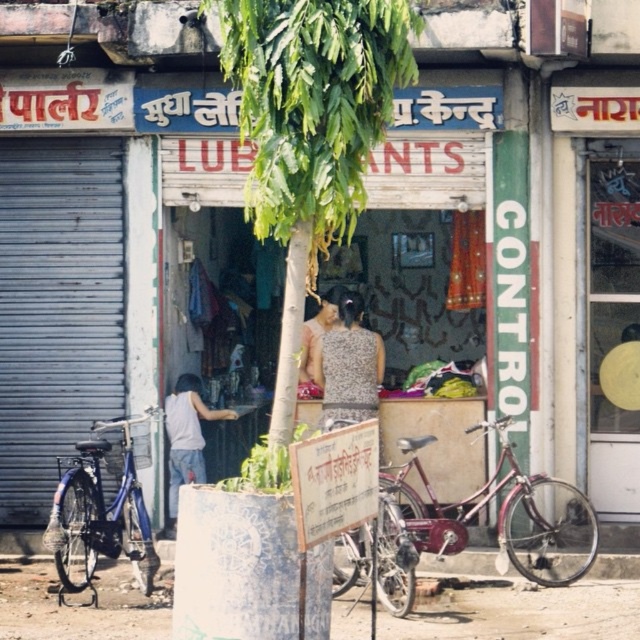
In the scene shown: You are a delivery person who needs to park your 1.8 meters tall delivery box next to the shiny metallic bicycle at center. Based on the scene, will the green leafy tree at center block the delivery box from being placed there?

The green leafy tree at center is much taller than the shiny metallic bicycle at center, so the tree might cast a shadow but won not physically block the delivery box from being placed next to the bicycle.

What is the point at coordinate (310,131) located on?

The point at coordinate (310,131) is located on the green leafy tree at center.

You are a pedestrian standing on the sidewalk in front of the shop. You need to walk to the entrance of the shop. Which object will you pass first as you walk towards the shop entrance? The green leafy tree at center or the blue metallic bicycle at left?

The blue metallic bicycle at left will be passed first because the green leafy tree at center is above it, meaning the tree is further away from the sidewalk compared to the bicycle.